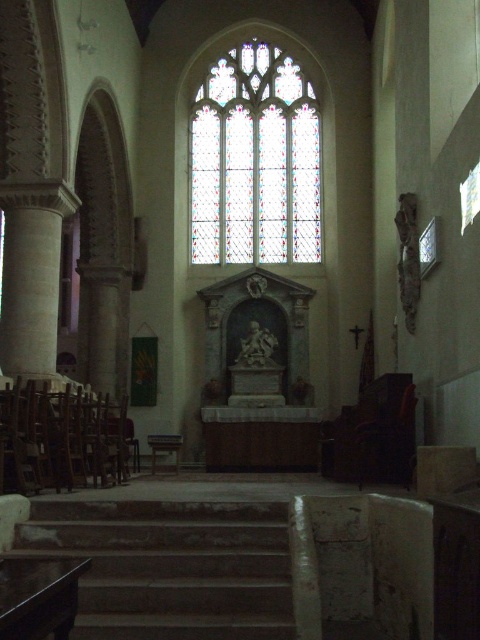
Is stained glass window at center further to the viewer compared to white stone column at left?

That is True.

Is stained glass window at center smaller than white stone column at left?

No.

Identify the location of stained glass window at center. (255, 161).

Identify the location of stone stairs at center. The image size is (480, 640). (170, 566).

Between stone stairs at center and stained glass window at center, which one has less height?

stone stairs at center is shorter.

What are the coordinates of `stone stairs at center` in the screenshot? It's located at (170, 566).

Locate an element on the screen. The image size is (480, 640). stone stairs at center is located at coordinates (170, 566).

Can you confirm if wooden at left is bigger than white stone column at left?

Correct, wooden at left is larger in size than white stone column at left.

Can you confirm if wooden at left is positioned below white stone column at left?

Indeed, wooden at left is positioned under white stone column at left.

The image size is (480, 640). Describe the element at coordinates (60, 438) in the screenshot. I see `wooden at left` at that location.

This screenshot has height=640, width=480. Identify the location of wooden at left. (60, 438).